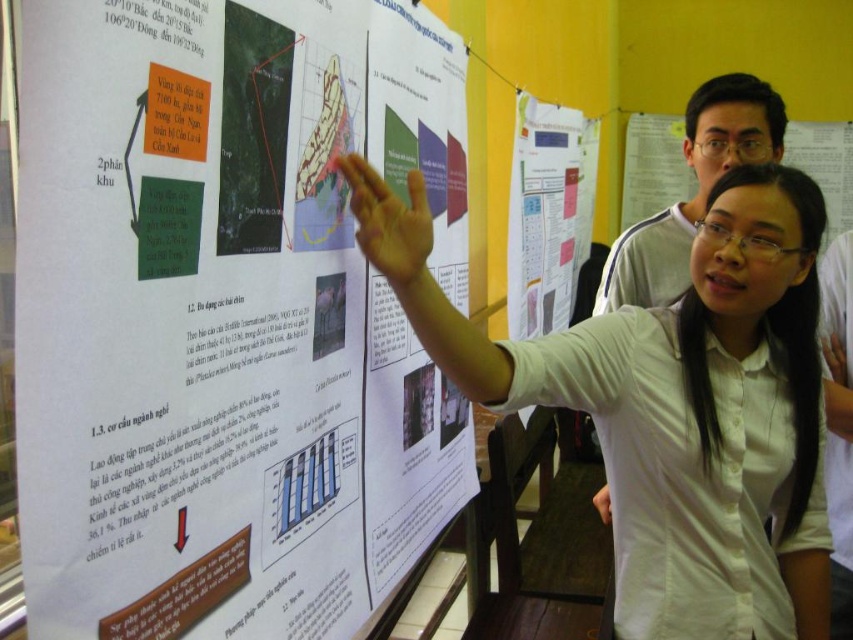
Question: Does white paper poster at center have a smaller size compared to white paper at center?

Choices:
 (A) yes
 (B) no

Answer: (A)

Question: Which object is closer to the camera taking this photo?

Choices:
 (A) white paper at center
 (B) white shirt at center

Answer: (B)

Question: Which is farther from the white paper poster at center?

Choices:
 (A) white paper at center
 (B) white shirt at center

Answer: (A)

Question: Does white paper poster at center lie behind white shirt at center?

Choices:
 (A) no
 (B) yes

Answer: (A)

Question: Which point is closer to the camera?

Choices:
 (A) white paper at center
 (B) white shirt at center

Answer: (B)

Question: Does white shirt at center appear under white paper at center?

Choices:
 (A) yes
 (B) no

Answer: (A)